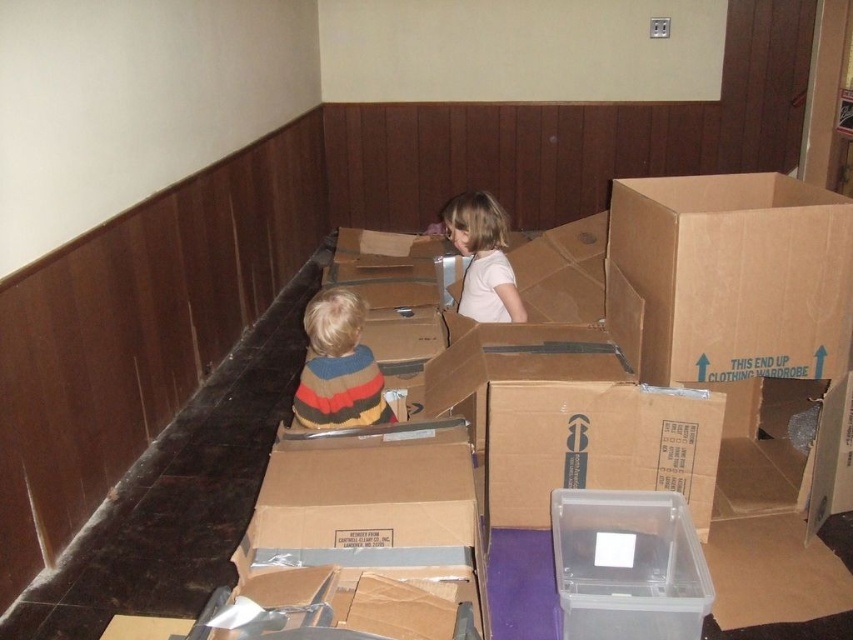
You are a delivery person who just arrived at a house. You need to place a new clear plastic container at center in the room. Where should you put it?

The clear plastic container at center should be placed at the coordinates point (627, 564).